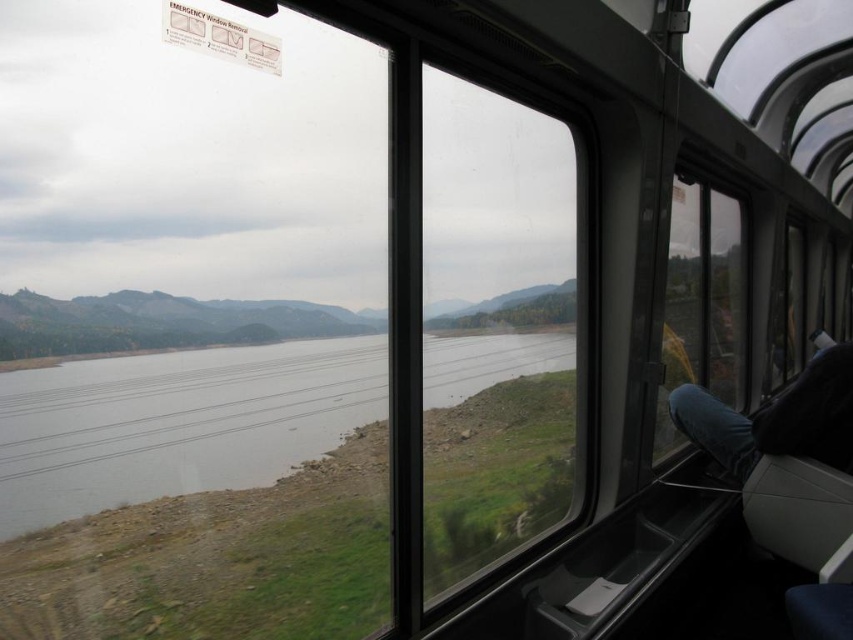
Question: Among these points, which one is farthest from the camera?

Choices:
 (A) (90, 500)
 (B) (838, 394)

Answer: (B)

Question: Is gray water at center bigger than jeans at right?

Choices:
 (A) yes
 (B) no

Answer: (B)

Question: Does gray water at center appear over jeans at right?

Choices:
 (A) no
 (B) yes

Answer: (B)

Question: Which point is closer to the camera?

Choices:
 (A) jeans at right
 (B) gray water at center

Answer: (B)

Question: Which point appears farthest from the camera in this image?

Choices:
 (A) (138, 499)
 (B) (741, 465)

Answer: (B)

Question: Is gray water at center smaller than jeans at right?

Choices:
 (A) no
 (B) yes

Answer: (B)